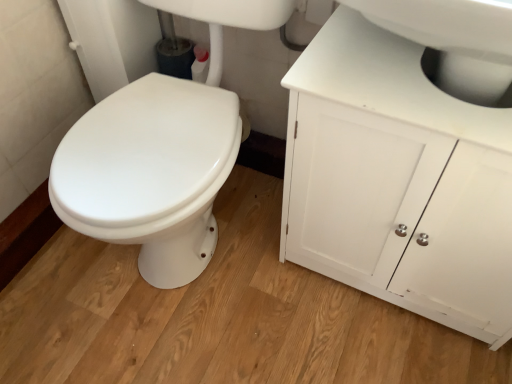
You are a GUI agent. You are given a task and a screenshot of the screen. Output one action in this format:
    pyautogui.click(x=<x>, y=<y>)
    Task: Click on the white matte cabinet at upper right
    This screenshot has width=512, height=384.
    Given the screenshot: What is the action you would take?
    coord(398,181)

Consider the image. In order to face white matte cabinet at upper right, should I rotate leftwards or rightwards?

It's best to rotate right around 22.029 degrees.

What do you see at coordinates (398, 181) in the screenshot? I see `white matte cabinet at upper right` at bounding box center [398, 181].

At what (x,y) coordinates should I click in order to perform the action: click on white glossy sink at upper right. Please return your answer as a coordinate pair (x, y). The image size is (512, 384). Looking at the image, I should click on (454, 40).

This screenshot has width=512, height=384. What do you see at coordinates (454, 40) in the screenshot?
I see `white glossy sink at upper right` at bounding box center [454, 40].

In order to click on white matte cabinet at upper right in this screenshot , I will do `click(398, 181)`.

Between white matte cabinet at upper right and white glossy sink at upper right, which one appears on the right side from the viewer's perspective?

white matte cabinet at upper right.

Is the depth of white matte cabinet at upper right greater than that of white glossy sink at upper right?

Yes, white matte cabinet at upper right is behind white glossy sink at upper right.

Considering the positions of point (309, 228) and point (401, 4), is point (309, 228) closer or farther from the camera than point (401, 4)?

Clearly, point (309, 228) is more distant from the camera than point (401, 4).

From the image's perspective, is white matte cabinet at upper right under white glossy sink at upper right?

Indeed, from the image's perspective, white matte cabinet at upper right is shown beneath white glossy sink at upper right.

From a real-world perspective, is white matte cabinet at upper right on top of white glossy sink at upper right?

No, from a real-world perspective, white matte cabinet at upper right is not over white glossy sink at upper right

Considering the relative sizes of white matte cabinet at upper right and white glossy sink at upper right in the image provided, is white matte cabinet at upper right wider than white glossy sink at upper right?

Incorrect, the width of white matte cabinet at upper right does not surpass that of white glossy sink at upper right.

Which of these two, white matte cabinet at upper right or white glossy sink at upper right, stands taller?

Standing taller between the two is white matte cabinet at upper right.

Based on their sizes in the image, would you say white matte cabinet at upper right is bigger or smaller than white glossy sink at upper right?

In the image, white matte cabinet at upper right appears to be larger than white glossy sink at upper right.

Can white glossy sink at upper right be found inside white matte cabinet at upper right?

No, white matte cabinet at upper right does not contain white glossy sink at upper right.

Are white matte cabinet at upper right and white glossy sink at upper right far apart?

No.

Is white matte cabinet at upper right facing away from white glossy sink at upper right?

Result: No, white matte cabinet at upper right is not facing away from white glossy sink at upper right.

Looking at this image, can you tell me how much white matte cabinet at upper right and white glossy sink at upper right differ in facing direction?

There is a 1.34-degree angle between the facing directions of white matte cabinet at upper right and white glossy sink at upper right.

How distant is white matte cabinet at upper right from white glossy sink at upper right?

white matte cabinet at upper right is 8.67 inches away from white glossy sink at upper right.

Identify the location of sink in front of the white matte cabinet at upper right. (x=454, y=40).

Considering the relative positions of white glossy sink at upper right and white matte cabinet at upper right in the image provided, is white glossy sink at upper right to the left or to the right of white matte cabinet at upper right?

Based on their positions, white glossy sink at upper right is located to the left of white matte cabinet at upper right.

Does white glossy sink at upper right lie in front of white matte cabinet at upper right?

Yes, white glossy sink at upper right is closer to the camera.

Is point (466, 79) farther from viewer compared to point (304, 113)?

No, it is not.

From the image's perspective, is white glossy sink at upper right located above or below white matte cabinet at upper right?

Based on their image positions, white glossy sink at upper right is located above white matte cabinet at upper right.

From a real-world perspective, which object rests below the other?

From a 3D spatial view, white matte cabinet at upper right is below.

Looking at this image, considering the sizes of objects white glossy sink at upper right and white matte cabinet at upper right in the image provided, who is thinner, white glossy sink at upper right or white matte cabinet at upper right?

Thinner between the two is white matte cabinet at upper right.

Is white glossy sink at upper right taller than white matte cabinet at upper right?

No.

In the scene shown: Is white glossy sink at upper right smaller than white matte cabinet at upper right?

Indeed, white glossy sink at upper right has a smaller size compared to white matte cabinet at upper right.

Is white glossy sink at upper right not inside white matte cabinet at upper right?

white glossy sink at upper right is positioned outside white matte cabinet at upper right.

Is white glossy sink at upper right touching white matte cabinet at upper right?

white glossy sink at upper right and white matte cabinet at upper right are not in contact.

Is white glossy sink at upper right facing away from white matte cabinet at upper right?

No, white glossy sink at upper right is not facing the opposite direction of white matte cabinet at upper right.

What's the angular difference between white glossy sink at upper right and white matte cabinet at upper right's facing directions?

They differ by 1.34 degrees in their facing directions.

How distant is white glossy sink at upper right from white matte cabinet at upper right?

A distance of 8.67 inches exists between white glossy sink at upper right and white matte cabinet at upper right.

The image size is (512, 384). I want to click on sink lying above the white matte cabinet at upper right (from the image's perspective), so 454,40.

You are a GUI agent. You are given a task and a screenshot of the screen. Output one action in this format:
    pyautogui.click(x=<x>, y=<y>)
    Task: Click on the bathroom cabinet that is behind the white glossy sink at upper right
    
    Given the screenshot: What is the action you would take?
    pyautogui.click(x=398, y=181)

Locate an element on the screen. sink that is on the left side of white matte cabinet at upper right is located at coordinates (454, 40).